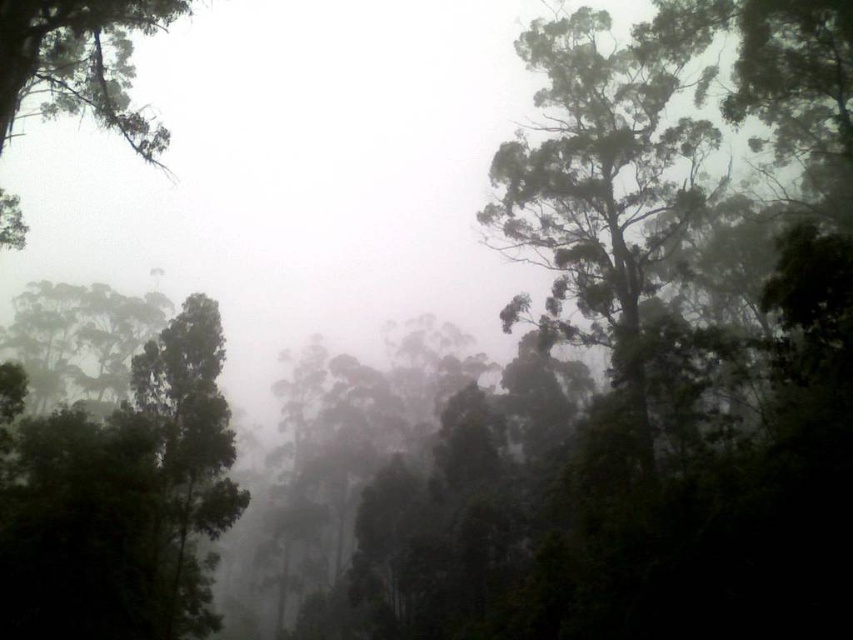
You are an explorer navigating through the misty forest. You see the green leafy tree at upper right and the green matte tree at upper left. Which tree is closer to you?

The green leafy tree at upper right is closer to you than the green matte tree at upper left.

You are navigating through the misty forest depicted in the image. You notice two points marked in the scene. Which point, point (621, 132) or point (184, 323), is nearer to you as you stand in the forest?

Point (621, 132) is closer to the viewer than point (184, 323).

You are hiking through the misty forest and want to take a photo of the green leafy tree at upper right and the green matte tree at left. Which tree should you focus on to capture both in the foreground and background?

The green leafy tree at upper right is positioned over the green matte tree at left, so focusing on the green leafy tree at upper right will place it in the foreground and the green matte tree at left in the background.